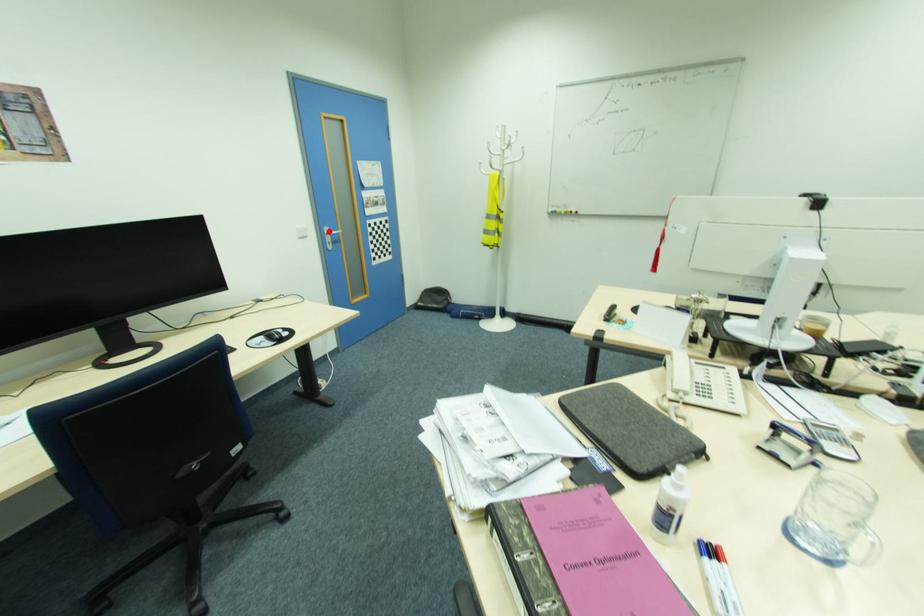
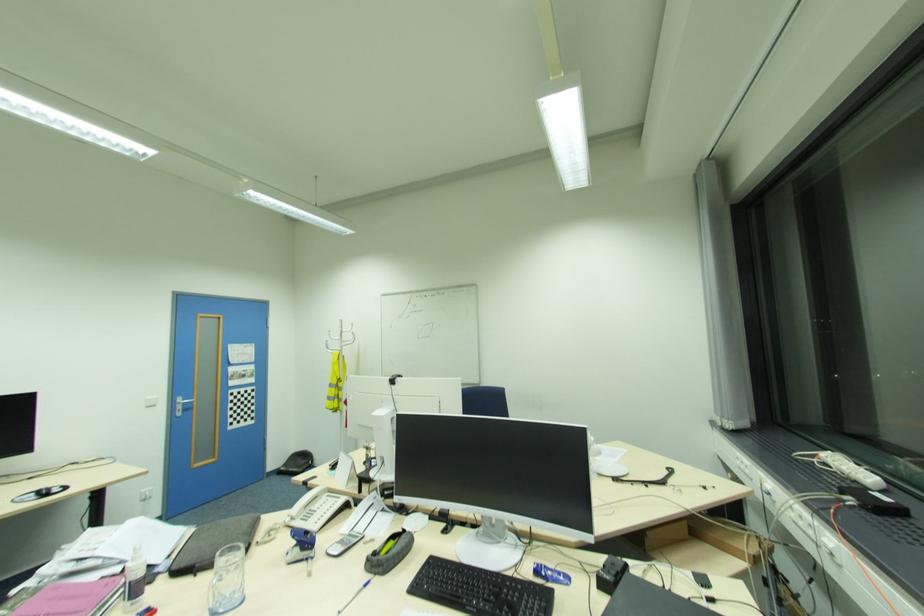
Question: I am providing you with two images of the same scene from different viewpoints. In image1, a red point is highlighted. Considering the same 3D point in image2, which of the following is correct?

Choices:
 (A) It is closer
 (B) It is farther

Answer: (B)